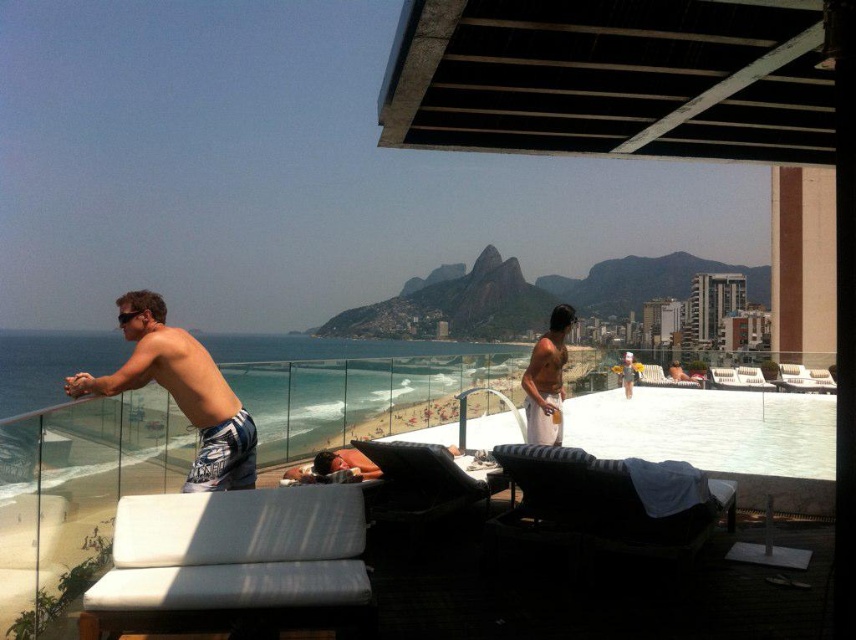
Between point (536, 448) and point (556, 342), which one is positioned behind?

The point (556, 342) is more distant.

Is point (693, 518) in front of point (559, 403)?

Yes, point (693, 518) is closer to viewer.

Between point (691, 532) and point (527, 390), which one is positioned behind?

The point (527, 390) is more distant.

I want to click on black striped daybed at lower right, so point(609,502).

Is point (622, 532) in front of point (170, 340)?

No, it is behind (170, 340).

Who is more forward, [568,512] or [215,461]?

Point [215,461]

The width and height of the screenshot is (856, 640). I want to click on black striped daybed at lower right, so click(609, 502).

In the scene shown: Can you confirm if white textured shorts at left is wider than white cotton shorts at center?

Yes.

Describe the element at coordinates (181, 392) in the screenshot. I see `white textured shorts at left` at that location.

Is point (179, 342) more distant than point (557, 410)?

No, (179, 342) is in front of (557, 410).

Locate an element on the screen. This screenshot has width=856, height=640. white textured shorts at left is located at coordinates (181, 392).